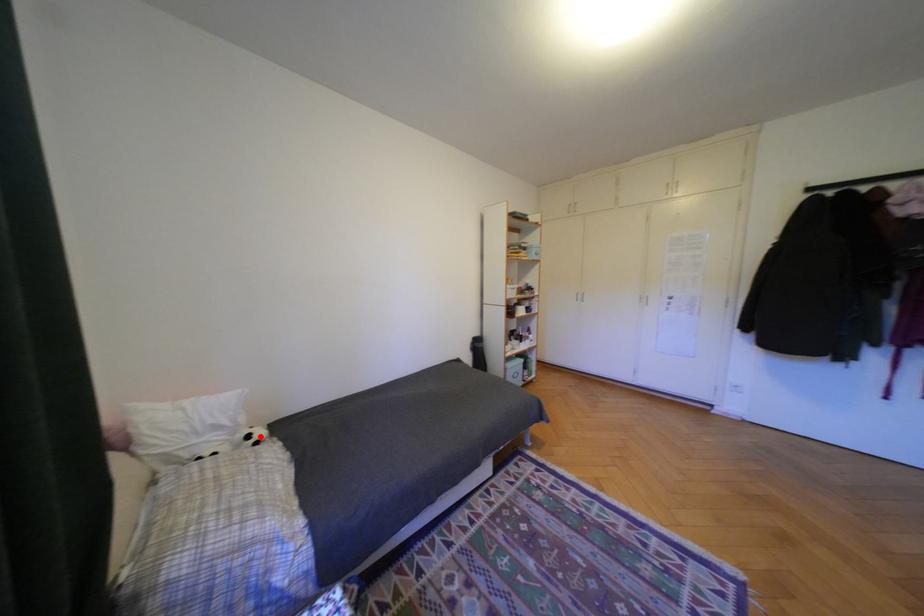
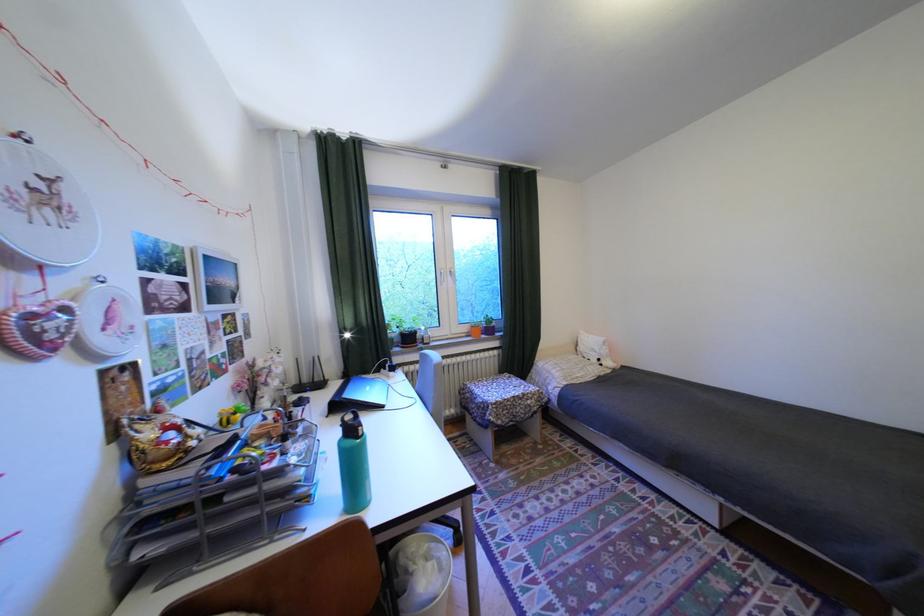
Where in the second image is the point corresponding to the highlighted location from the first image?

(611, 360)